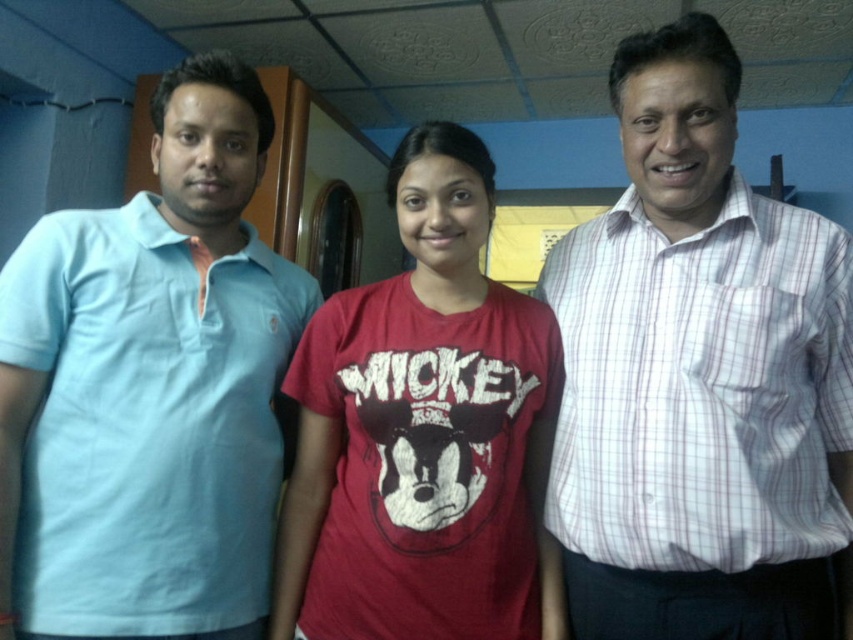
You are standing in the room and want to touch both the point at coordinates (547, 397) and the point at coordinates (822, 372). Which point should you reach for first?

You should reach for the point at coordinates (547, 397) first because it is closer to you than the point at coordinates (822, 372), which is further away.

You are standing in the room and want to know which of the two points, point (170,115) or point (711,256), is closer to you. Can you determine this based on their positions?

Point (170,115) is closer to you than point (711,256) because it is further to the viewer.